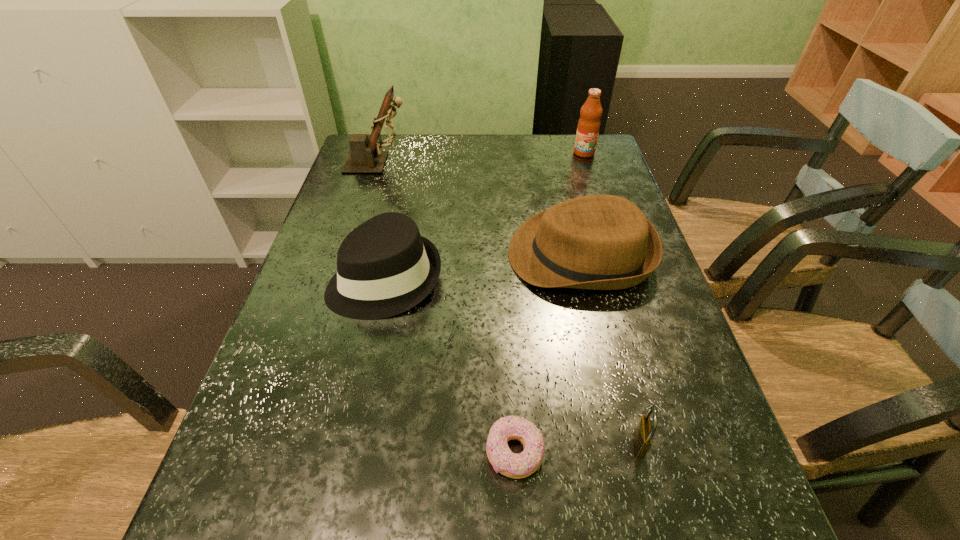
Where is `padlock located at the right edge`? padlock located at the right edge is located at coordinates (643, 434).

Find the location of a particular element. object located in the far left corner section of the desktop is located at coordinates (366, 156).

Locate an element on the screen. This screenshot has width=960, height=540. object at the far right corner is located at coordinates (588, 127).

The height and width of the screenshot is (540, 960). What are the coordinates of `free space at the far edge of the desktop` in the screenshot? It's located at (541, 159).

Locate an element on the screen. vacant area at the left edge is located at coordinates (346, 335).

In the image, there is a desktop. Where is `free region at the right edge`? The height and width of the screenshot is (540, 960). free region at the right edge is located at coordinates (646, 353).

The image size is (960, 540). I want to click on vacant region at the far right corner of the desktop, so click(x=604, y=143).

Where is `vacant area that lies between the fifth tallest object and the shortest object`? The height and width of the screenshot is (540, 960). vacant area that lies between the fifth tallest object and the shortest object is located at coordinates (577, 448).

Image resolution: width=960 pixels, height=540 pixels. In order to click on free spot between the left fedora and the right fedora in this screenshot , I will do `click(483, 267)`.

The image size is (960, 540). In order to click on blank region between the fruit juice and the figurine in this screenshot , I will do `click(481, 158)`.